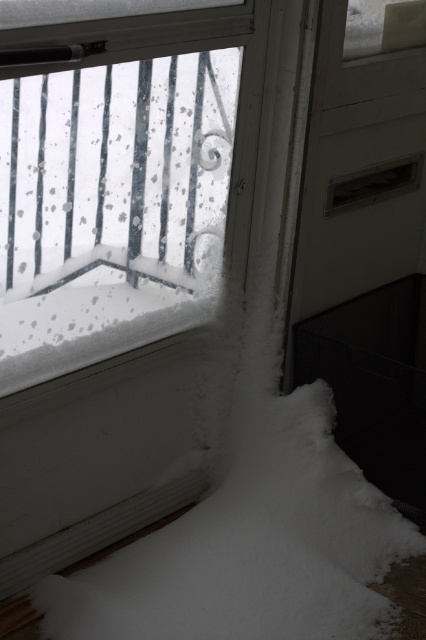
You are standing inside the building looking out the window. You see the white matte screen door at lower right and the white fluffy snow at lower left. Which object is closer to you, the observer?

The white fluffy snow at lower left is behind the white matte screen door at lower right, so the white matte screen door at lower right is closer to you.

You are trying to determine which object is narrower between the white matte screen door at lower right and the white fluffy snow at lower left. Based on the scene, which one is thinner?

The white matte screen door at lower right is thinner than the white fluffy snow at lower left.

You are standing inside the building and looking through the window. You need to exit through the white matte screen door at lower right but first want to check if it is bigger than the white fluffy snow at lower left. Can you confirm this based on what you see?

The white matte screen door at lower right has a larger size compared to the white fluffy snow at lower left, so yes, the door is bigger than the snow area.